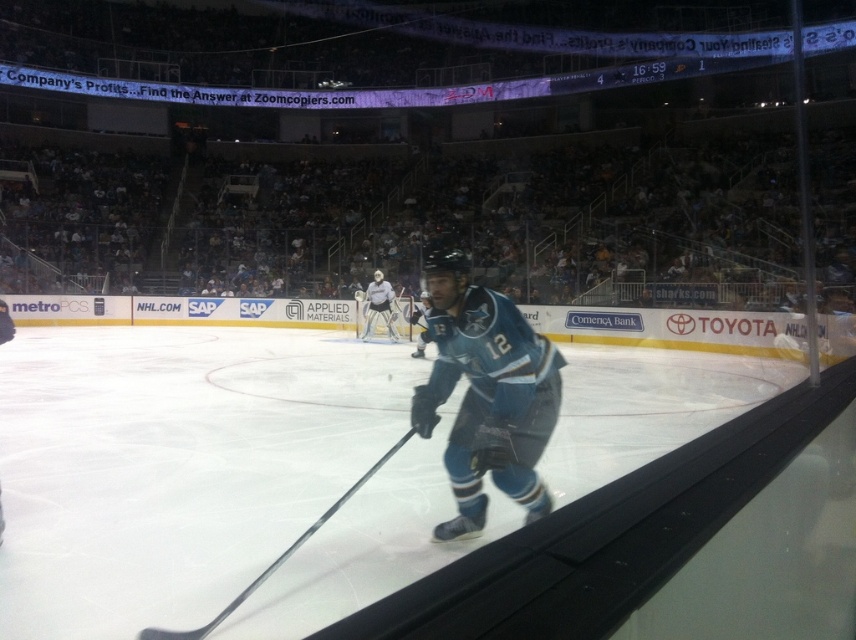
Which is behind, point (449, 460) or point (367, 317)?

The point (367, 317) is more distant.

Measure the distance between teal jersey at center and camera.

teal jersey at center and camera are 3.61 meters apart from each other.

What do you see at coordinates (486, 394) in the screenshot? I see `teal jersey at center` at bounding box center [486, 394].

Find the location of `teal jersey at center`. teal jersey at center is located at coordinates (486, 394).

Who is lower down, metallic silver hockey stick at center or white matte goalie at center?

metallic silver hockey stick at center is lower down.

Between point (370, 474) and point (370, 332), which one is positioned in front?

Point (370, 474) is in front.

In order to click on metallic silver hockey stick at center in this screenshot , I will do `click(274, 560)`.

The image size is (856, 640). What do you see at coordinates (486, 394) in the screenshot?
I see `teal jersey at center` at bounding box center [486, 394].

What are the coordinates of `teal jersey at center` in the screenshot? It's located at (486, 394).